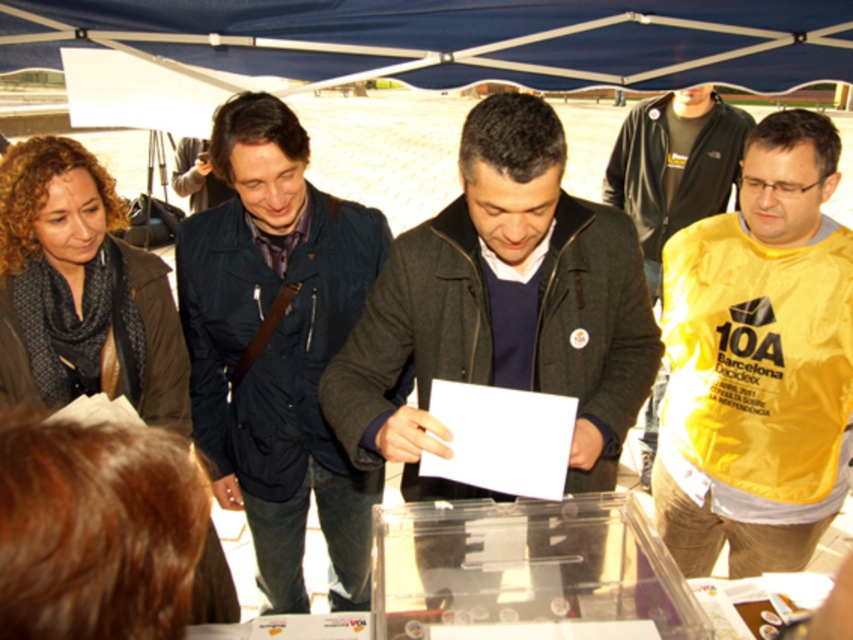
Between dark blue jacket at center and blue fabric canopy at upper center, which one is positioned higher?

blue fabric canopy at upper center

Who is positioned more to the right, dark blue jacket at center or blue fabric canopy at upper center?

blue fabric canopy at upper center is more to the right.

Locate an element on the screen. The image size is (853, 640). dark blue jacket at center is located at coordinates (277, 348).

Does dark gray jacket at center have a greater width compared to blue fabric canopy at upper center?

No.

From the picture: Does dark gray jacket at center have a larger size compared to blue fabric canopy at upper center?

Correct, dark gray jacket at center is larger in size than blue fabric canopy at upper center.

You are a GUI agent. You are given a task and a screenshot of the screen. Output one action in this format:
    pyautogui.click(x=<x>, y=<y>)
    Task: Click on the dark gray jacket at center
    Image resolution: width=853 pixels, height=640 pixels.
    Given the screenshot: What is the action you would take?
    pyautogui.click(x=502, y=307)

Where is `dark gray jacket at center`? The height and width of the screenshot is (640, 853). dark gray jacket at center is located at coordinates (502, 307).

Is dark gray jacket at center smaller than yellow fabric shirt at right?

Correct, dark gray jacket at center occupies less space than yellow fabric shirt at right.

In the scene shown: Can you confirm if dark gray jacket at center is wider than yellow fabric shirt at right?

No.

Locate an element on the screen. The width and height of the screenshot is (853, 640). dark gray jacket at center is located at coordinates (502, 307).

Find the location of a particular element. dark gray jacket at center is located at coordinates (502, 307).